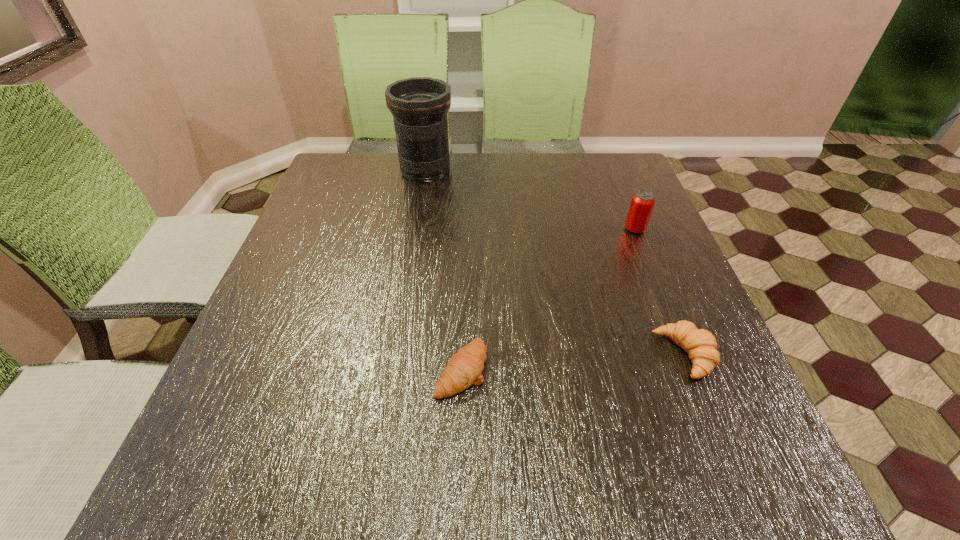
Image resolution: width=960 pixels, height=540 pixels. I want to click on object that can be found as the second closest to the left crescent roll, so click(x=642, y=203).

Where is `free space that satisfies the following two spatial constraints: 1. on the front side of the can; 2. on the right side of the telephoto lens`? The height and width of the screenshot is (540, 960). free space that satisfies the following two spatial constraints: 1. on the front side of the can; 2. on the right side of the telephoto lens is located at coordinates (416, 229).

Locate an element on the screen. This screenshot has height=540, width=960. vacant space that satisfies the following two spatial constraints: 1. on the back side of the right crescent roll; 2. on the right side of the left crescent roll is located at coordinates (462, 355).

Identify the location of blank area in the image that satisfies the following two spatial constraints: 1. on the back side of the second tallest object; 2. on the left side of the left crescent roll. Image resolution: width=960 pixels, height=540 pixels. (467, 229).

Where is `vacant position in the image that satisfies the following two spatial constraints: 1. on the front side of the farthest object; 2. on the left side of the right crescent roll`? vacant position in the image that satisfies the following two spatial constraints: 1. on the front side of the farthest object; 2. on the left side of the right crescent roll is located at coordinates (395, 355).